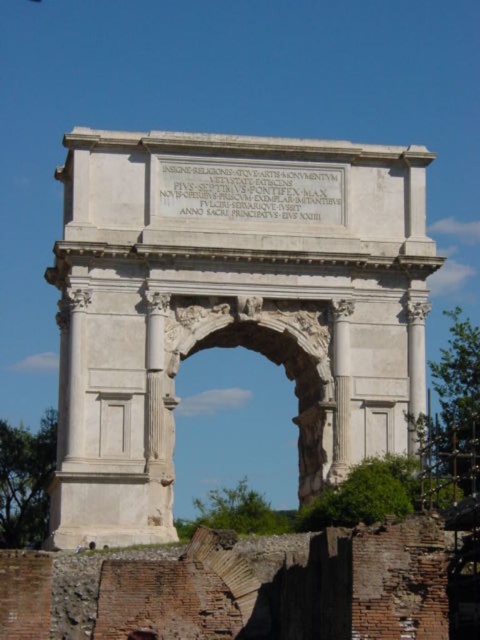
Which is behind, point (171, 445) or point (308, 410)?

Positioned behind is point (308, 410).

Can you confirm if white stone arch at center is smaller than white stone archway at center?

Actually, white stone arch at center might be larger than white stone archway at center.

Which is behind, point (288, 308) or point (256, 305)?

The point (288, 308) is more distant.

You are a GUI agent. You are given a task and a screenshot of the screen. Output one action in this format:
    pyautogui.click(x=<x>, y=<y>)
    Task: Click on the white stone arch at center
    
    Given the screenshot: What is the action you would take?
    pyautogui.click(x=229, y=305)